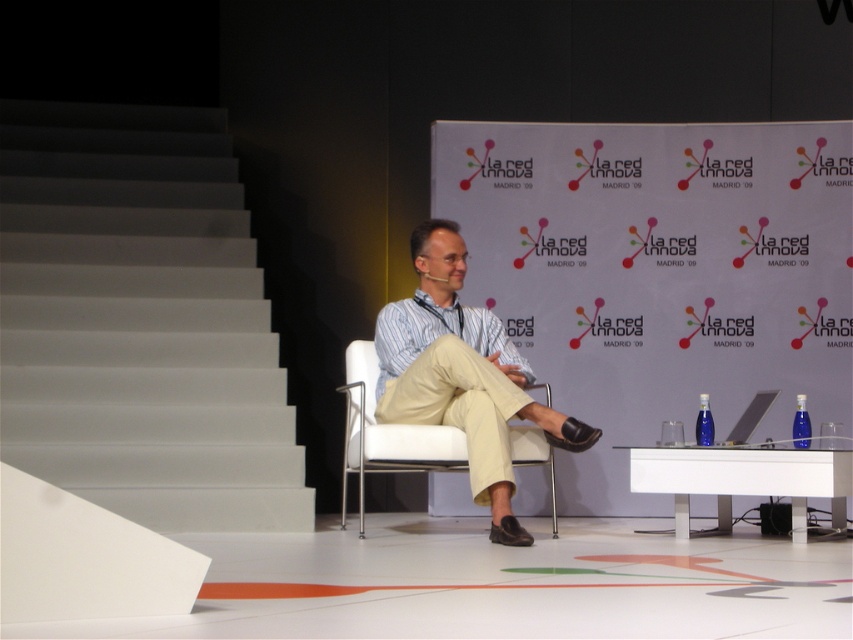
Question: Where is white smooth stairs at left located in relation to white fabric chair at center in the image?

Choices:
 (A) below
 (B) above

Answer: (B)

Question: Which point is farther from the camera taking this photo?

Choices:
 (A) (422, 355)
 (B) (119, 122)
 (C) (367, 358)

Answer: (B)

Question: Which object is the farthest from the white smooth stairs at left?

Choices:
 (A) white fabric chair at center
 (B) light beige cotton pants at center

Answer: (B)

Question: Is white smooth stairs at left to the left of light beige cotton pants at center from the viewer's perspective?

Choices:
 (A) yes
 (B) no

Answer: (A)

Question: Can you confirm if white smooth stairs at left is smaller than light beige cotton pants at center?

Choices:
 (A) no
 (B) yes

Answer: (A)

Question: Which point appears closest to the camera in this image?

Choices:
 (A) (344, 465)
 (B) (4, 381)
 (C) (584, 432)

Answer: (C)